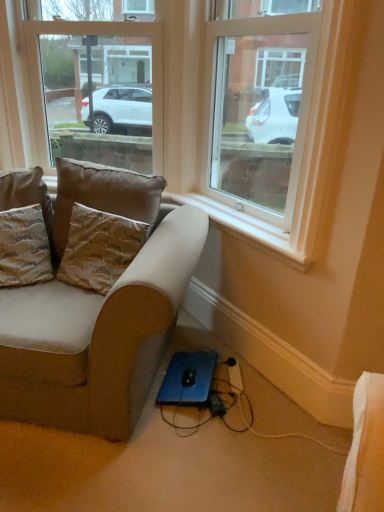
Question: Can you confirm if black plastic extension cord at lower center is smaller than beige fabric couch at lower left?

Choices:
 (A) yes
 (B) no

Answer: (A)

Question: From a real-world perspective, does black plastic extension cord at lower center sit lower than beige fabric couch at lower left?

Choices:
 (A) no
 (B) yes

Answer: (B)

Question: Is black plastic extension cord at lower center with beige fabric couch at lower left?

Choices:
 (A) yes
 (B) no

Answer: (B)

Question: From a real-world perspective, is black plastic extension cord at lower center on top of beige fabric couch at lower left?

Choices:
 (A) no
 (B) yes

Answer: (A)

Question: Is beige fabric couch at lower left at the back of black plastic extension cord at lower center?

Choices:
 (A) yes
 (B) no

Answer: (B)

Question: Does black plastic extension cord at lower center have a larger size compared to beige fabric couch at lower left?

Choices:
 (A) yes
 (B) no

Answer: (B)

Question: Is textured brown pillow at left, the 3th pillow viewed from the right, positioned with its back to brown fabric pillow at upper left, the 2th pillow from the right?

Choices:
 (A) yes
 (B) no

Answer: (B)

Question: Considering the relative sizes of textured brown pillow at left, the 3th pillow viewed from the right, and brown fabric pillow at upper left, the 2th pillow from the right, in the image provided, is textured brown pillow at left, the 3th pillow viewed from the right, bigger than brown fabric pillow at upper left, the 2th pillow from the right,?

Choices:
 (A) no
 (B) yes

Answer: (A)

Question: Is textured brown pillow at left, the 3th pillow viewed from the right, taller than brown fabric pillow at upper left, the 2th pillow from the right?

Choices:
 (A) no
 (B) yes

Answer: (A)

Question: Could you tell me if textured brown pillow at left, which is counted as the 2th pillow, starting from the left, is turned towards brown fabric pillow at upper left, the 2th pillow from the right?

Choices:
 (A) yes
 (B) no

Answer: (B)

Question: Considering the relative sizes of textured brown pillow at left, which is counted as the 2th pillow, starting from the left, and brown fabric pillow at upper left, positioned as the third pillow in left-to-right order, in the image provided, is textured brown pillow at left, which is counted as the 2th pillow, starting from the left, wider than brown fabric pillow at upper left, positioned as the third pillow in left-to-right order,?

Choices:
 (A) no
 (B) yes

Answer: (B)

Question: Is textured brown pillow at left, the 3th pillow viewed from the right, smaller than brown fabric pillow at upper left, positioned as the third pillow in left-to-right order?

Choices:
 (A) no
 (B) yes

Answer: (B)

Question: From the image's perspective, is brown fabric pillow at upper left, positioned as the third pillow in left-to-right order, on top of clear glass window at upper center, which is counted as the first window, starting from the right?

Choices:
 (A) yes
 (B) no

Answer: (B)